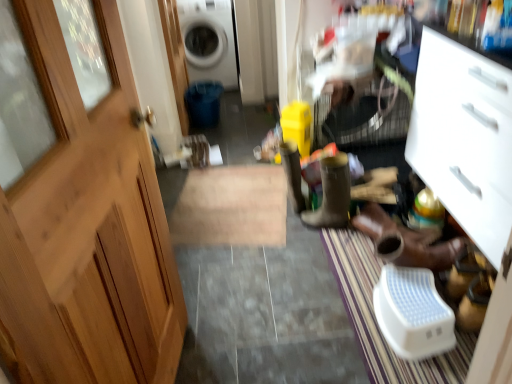
Question: In terms of width, does wooden door at left look wider or thinner when compared to yellow rubber boot at center?

Choices:
 (A) thin
 (B) wide

Answer: (A)

Question: In the image, is wooden door at left on the left side or the right side of yellow rubber boot at center?

Choices:
 (A) left
 (B) right

Answer: (A)

Question: Which object is the farthest from the white matte cabinet at right?

Choices:
 (A) wooden door at left
 (B) yellow rubber boot at center
 (C) white glossy washing machine at upper center
 (D) brown leather boot at center, arranged as the 1th footwear when viewed from the left
 (E) white textured doormat at lower right

Answer: (C)

Question: Considering the real-world distances, which object is closest to the white matte cabinet at right?

Choices:
 (A) brown leather shoes at lower right, the 1th footwear in the right-to-left sequence
 (B) wooden door at left
 (C) white textured doormat at lower right
 (D) white glossy washing machine at upper center
 (E) brown leather boot at center, arranged as the 1th footwear when viewed from the left

Answer: (A)